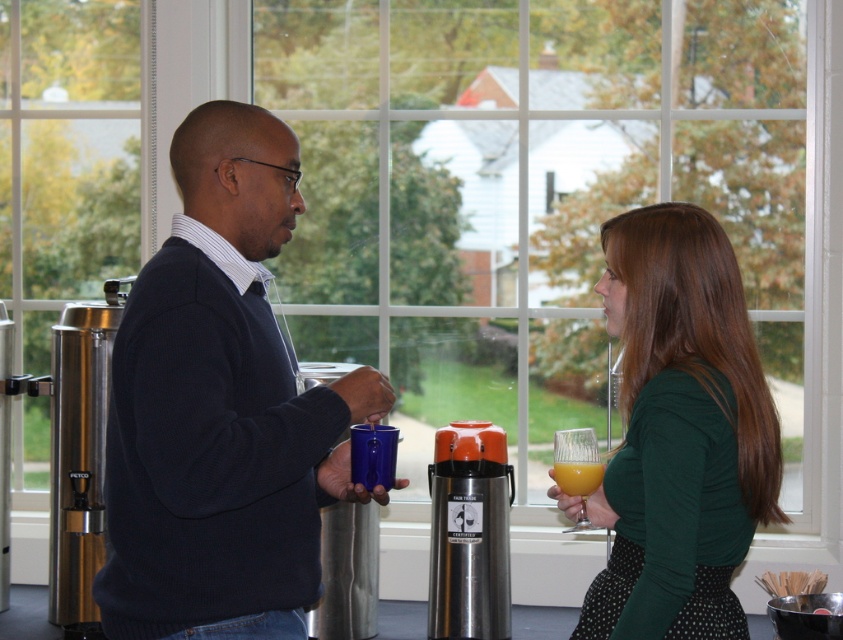
You are standing in the room and want to place a small plant between the two points, point (x=626, y=232) and point (x=554, y=476). Which point should the plant be closer to so it is positioned in front of the other point?

The plant should be closer to point (x=626, y=232) because it is in front of point (x=554, y=476).

Consider the image. You are an interior designer assessing the color coordination in the scene. Which object, the matte black sweater at center or the green matte shirt at center, is positioned higher up on the person?

The matte black sweater at center is located above the green matte shirt at center, so it is positioned higher up on the person.